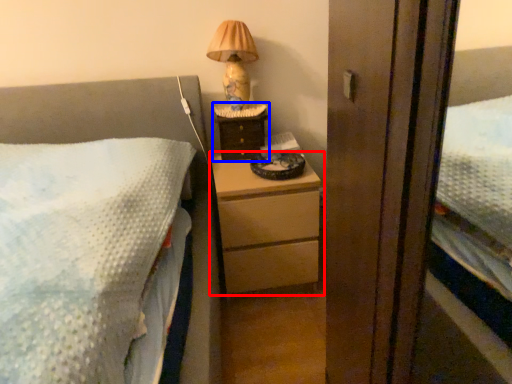
Question: Which point is closer to the camera, chest of drawers (highlighted by a red box) or nightstand (highlighted by a blue box)?

Choices:
 (A) chest of drawers
 (B) nightstand

Answer: (A)